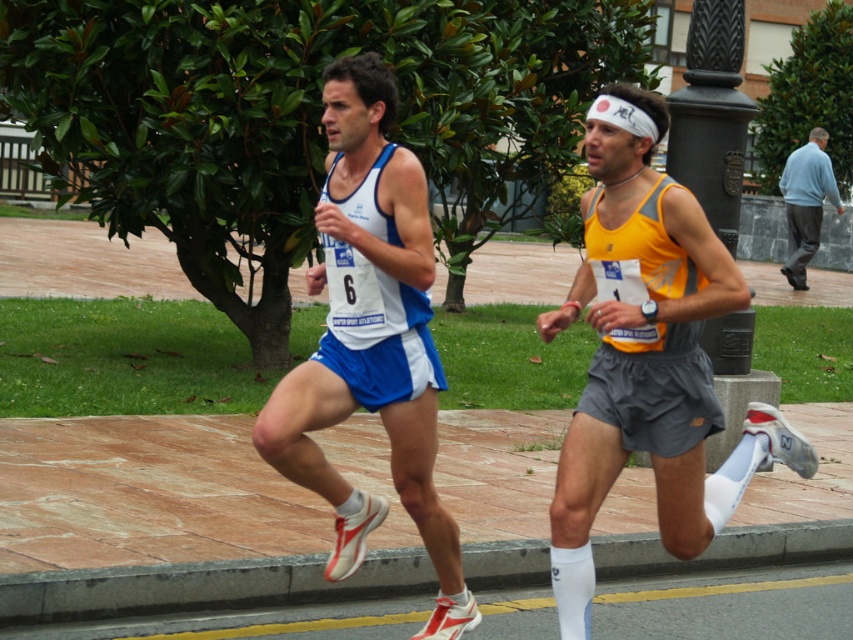
You are a photographer standing at the starting line of the race. You want to take a photo that includes both the gray concrete curb at lower center and the light blue sweater at right. Which object should you focus on first to ensure both are in frame?

You should focus on the light blue sweater at right first because it occupies more space than the gray concrete curb at lower center, so it will require more attention to frame properly.

You are a photographer standing at the starting line of the race. You want to take a photo that includes both the gray concrete curb at lower center and the light blue sweater at right. What is the minimum distance you need to walk forward to ensure both objects are in your frame?

The gray concrete curb at lower center is 14.96 meters from the light blue sweater at right. To include both in your frame, you need to walk forward until you are at least 14.96 meters away from the closer object.